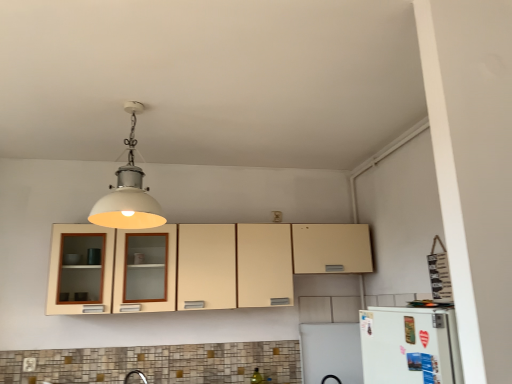
Question: From the image's perspective, is white matte light fixture at upper center above white matte refrigerator at lower right?

Choices:
 (A) no
 (B) yes

Answer: (B)

Question: Does white matte light fixture at upper center have a larger size compared to white matte refrigerator at lower right?

Choices:
 (A) no
 (B) yes

Answer: (B)

Question: Does white matte light fixture at upper center come in front of white matte refrigerator at lower right?

Choices:
 (A) no
 (B) yes

Answer: (A)

Question: Is white matte light fixture at upper center aimed at white matte refrigerator at lower right?

Choices:
 (A) no
 (B) yes

Answer: (A)

Question: Can you confirm if white matte light fixture at upper center is thinner than white matte refrigerator at lower right?

Choices:
 (A) no
 (B) yes

Answer: (A)

Question: Is matte white electric outlet at lower left taller or shorter than beige matte cabinet at center?

Choices:
 (A) tall
 (B) short

Answer: (B)

Question: Considering their positions, is matte white electric outlet at lower left located in front of or behind beige matte cabinet at center?

Choices:
 (A) behind
 (B) front

Answer: (A)

Question: From the image's perspective, is matte white electric outlet at lower left located above or below beige matte cabinet at center?

Choices:
 (A) above
 (B) below

Answer: (B)

Question: Would you say matte white electric outlet at lower left is to the left or to the right of beige matte cabinet at center in the picture?

Choices:
 (A) right
 (B) left

Answer: (B)

Question: From their relative heights in the image, would you say white matte refrigerator at lower right is taller or shorter than white matte light fixture at upper center?

Choices:
 (A) short
 (B) tall

Answer: (A)

Question: Relative to white matte light fixture at upper center, is white matte refrigerator at lower right in front or behind?

Choices:
 (A) behind
 (B) front

Answer: (B)

Question: Is point (446, 317) positioned closer to the camera than point (132, 225)?

Choices:
 (A) closer
 (B) farther

Answer: (A)

Question: Is white matte refrigerator at lower right inside the boundaries of white matte light fixture at upper center, or outside?

Choices:
 (A) outside
 (B) inside

Answer: (A)

Question: Would you say white matte light fixture at upper center is inside or outside beige matte cabinet at center?

Choices:
 (A) outside
 (B) inside

Answer: (A)

Question: Is point (135, 201) positioned closer to the camera than point (185, 294)?

Choices:
 (A) farther
 (B) closer

Answer: (B)